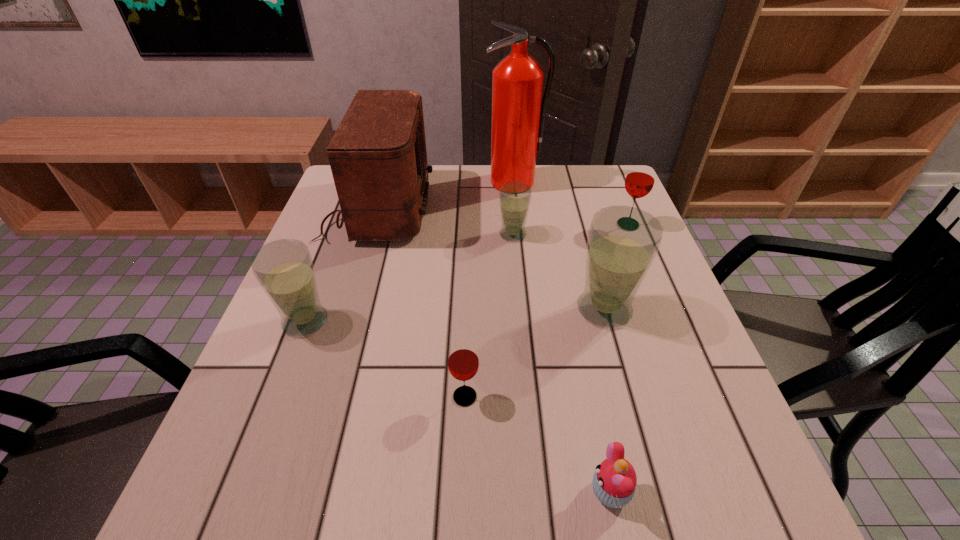
The image size is (960, 540). What are the coordinates of `vacant space situated 0.390m on the front of the smallest blue glass` in the screenshot? It's located at (525, 374).

At what (x,y) coordinates should I click in order to perform the action: click on vacant space situated 0.190m on the left of the second nearest object. Please return your answer as a coordinate pair (x, y). This screenshot has width=960, height=540. Looking at the image, I should click on (345, 396).

The image size is (960, 540). In order to click on free space located 0.100m on the face of the cupcake in this screenshot , I will do `click(524, 491)`.

In order to click on free space located 0.190m on the face of the cupcake in this screenshot , I will do `click(466, 491)`.

The width and height of the screenshot is (960, 540). I want to click on free space located 0.300m on the face of the cupcake, so click(x=394, y=491).

The height and width of the screenshot is (540, 960). I want to click on fire extinguisher that is at the far edge, so click(518, 116).

You are a GUI agent. You are given a task and a screenshot of the screen. Output one action in this format:
    pyautogui.click(x=<x>, y=<y>)
    Task: Click on the radio receiver at the far edge
    The width and height of the screenshot is (960, 540).
    Given the screenshot: What is the action you would take?
    pyautogui.click(x=378, y=158)

The height and width of the screenshot is (540, 960). Identify the location of object that is positioned at the near edge. (614, 481).

The image size is (960, 540). I want to click on radio receiver that is at the left edge, so click(378, 158).

The width and height of the screenshot is (960, 540). Find the location of `glass present at the left edge`. glass present at the left edge is located at coordinates (284, 269).